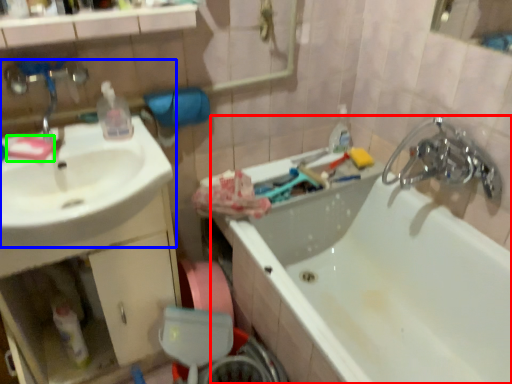
Question: Which object is the closest to the bathtub (highlighted by a red box)? Choose among these: sink (highlighted by a blue box) or soap (highlighted by a green box).

Choices:
 (A) sink
 (B) soap

Answer: (A)